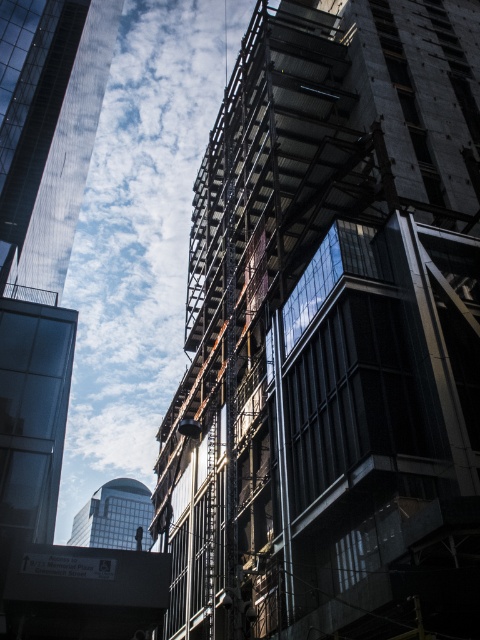
You are an architect evaluating the urban skyline. Which of the two buildings, the transparent glass skyscraper at left or the matte glass tower at center, appears taller from your current vantage point?

The transparent glass skyscraper at left appears taller than the matte glass tower at center from your current vantage point.

You are standing at the construction site and want to take a photo of both the concrete scaffolding at center and the transparent glass skyscraper at left. Which one will appear larger in your photo?

The concrete scaffolding at center will appear larger in your photo because it is closer to the viewer than the transparent glass skyscraper at left.